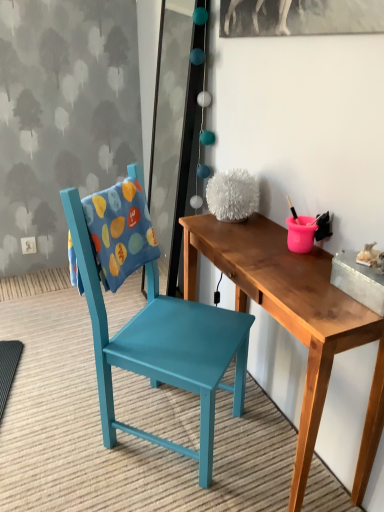
Question: Looking at the image, does wooden table at center seem bigger or smaller compared to teal painted wood chair at left?

Choices:
 (A) big
 (B) small

Answer: (B)

Question: Is wooden table at center taller or shorter than teal painted wood chair at left?

Choices:
 (A) tall
 (B) short

Answer: (B)

Question: Is wooden table at center in front of or behind teal painted wood chair at left in the image?

Choices:
 (A) front
 (B) behind

Answer: (A)

Question: Is teal painted wood chair at left to the left or to the right of wooden table at center in the image?

Choices:
 (A) left
 (B) right

Answer: (A)

Question: Considering the positions of point (208, 462) and point (183, 256), is point (208, 462) closer or farther from the camera than point (183, 256)?

Choices:
 (A) closer
 (B) farther

Answer: (A)

Question: From the image's perspective, is teal painted wood chair at left positioned above or below wooden table at center?

Choices:
 (A) below
 (B) above

Answer: (B)

Question: From a real-world perspective, relative to wooden table at center, is teal painted wood chair at left vertically above or below?

Choices:
 (A) above
 (B) below

Answer: (A)